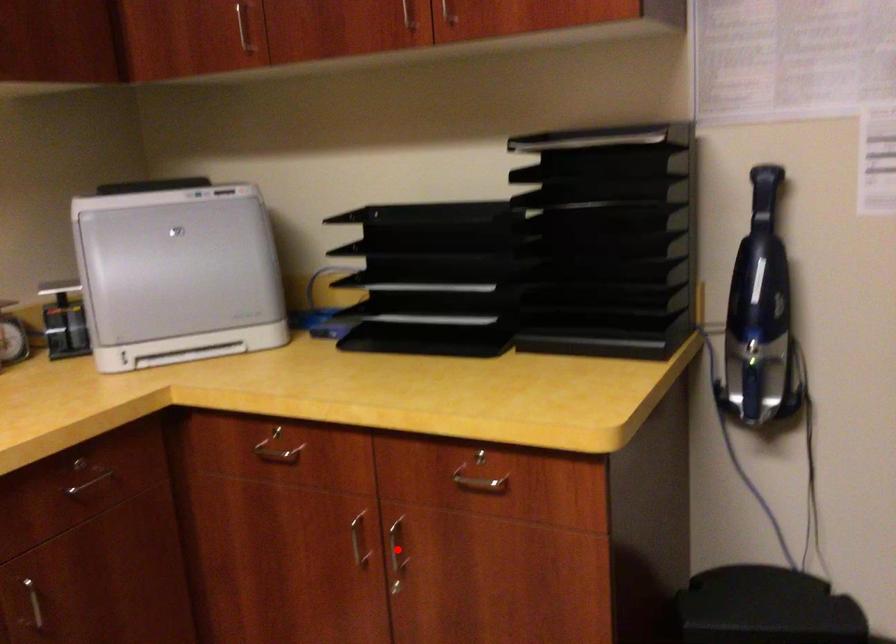
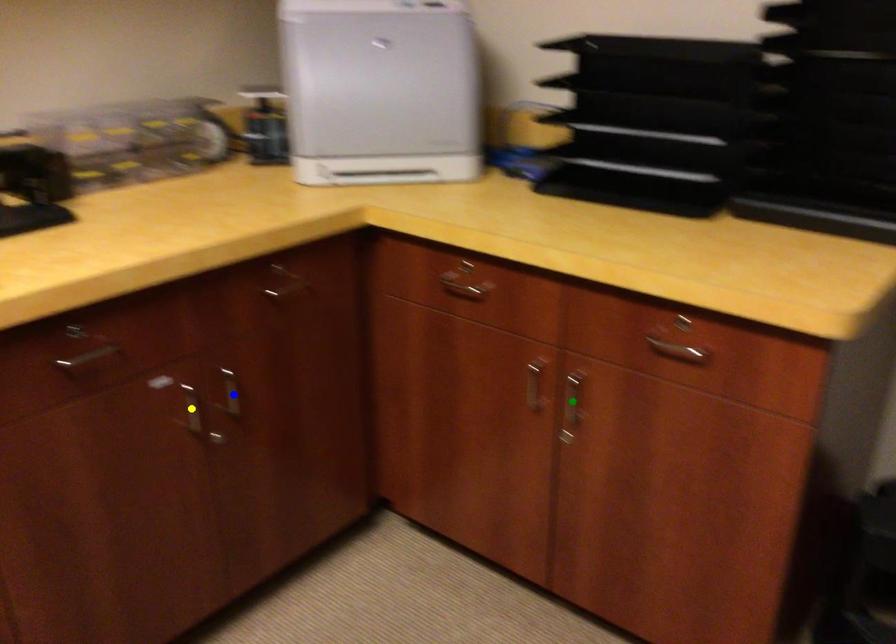
Question: I am providing you with two images of the same scene from different viewpoints. A red point is marked on the first image. You are given multiple points on the second image. Which point in image 2 represents the same 3d spot as the red point in image 1?

Choices:
 (A) yellow point
 (B) green point
 (C) blue point

Answer: (B)